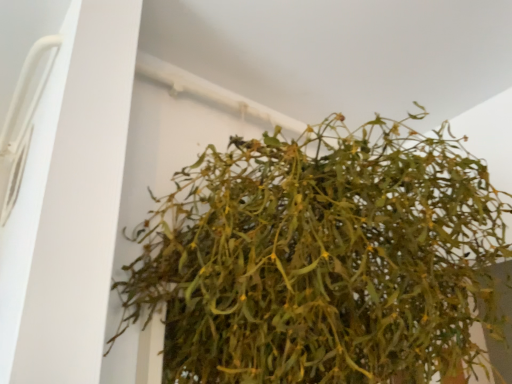
Find the location of a particular element. green leafy plant at upper center is located at coordinates (321, 259).

Measure the distance between point (407, 374) and camera.

Point (407, 374) and camera are 25.75 inches apart from each other.

What do you see at coordinates (321, 259) in the screenshot? I see `green leafy plant at upper center` at bounding box center [321, 259].

What are the coordinates of `green leafy plant at upper center` in the screenshot? It's located at (321, 259).